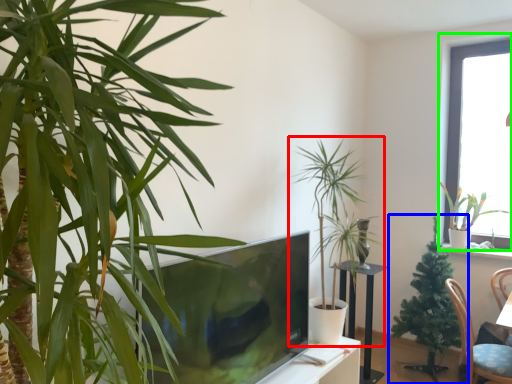
Question: Considering the real-world distances, which object is closest to houseplant (highlighted by a red box)? houseplant (highlighted by a blue box) or window (highlighted by a green box).

Choices:
 (A) houseplant
 (B) window

Answer: (A)